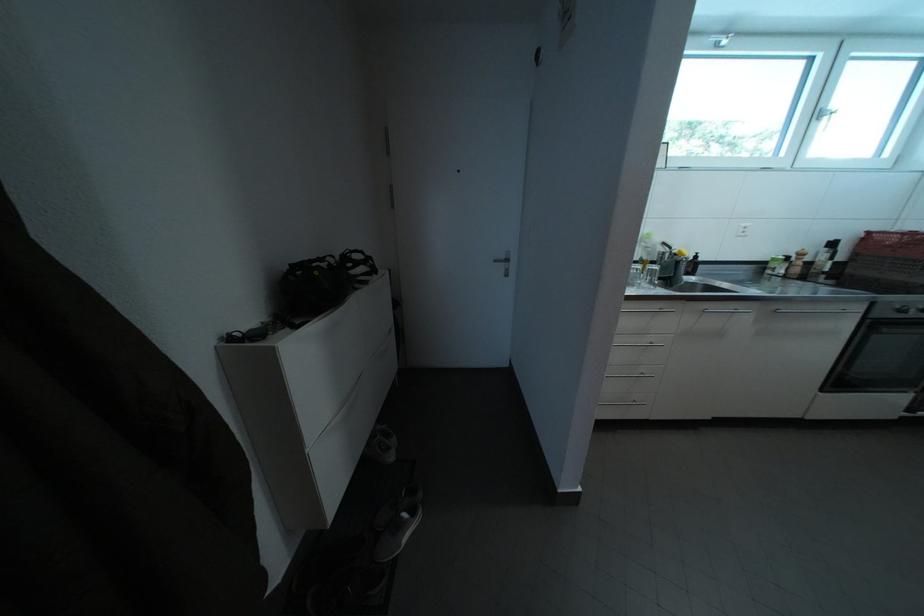
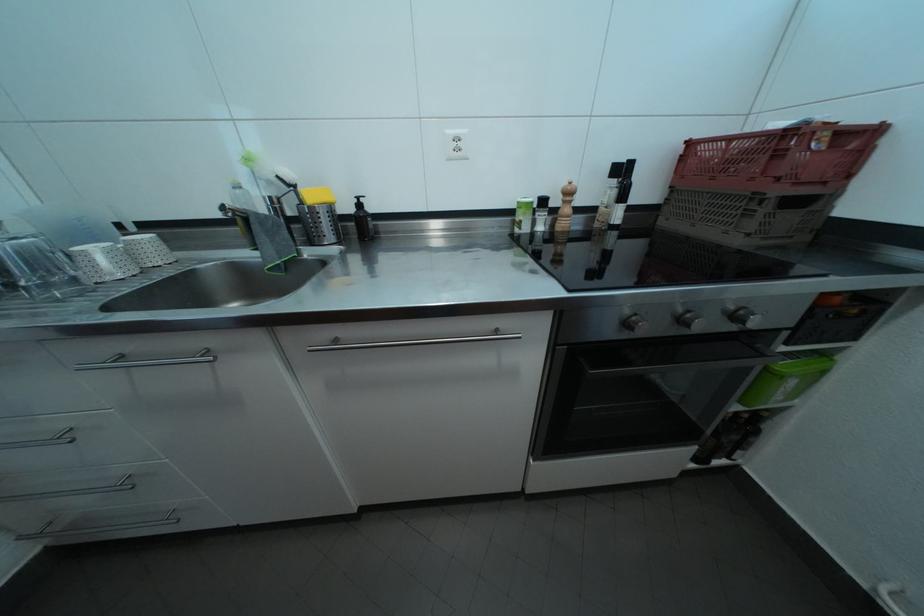
In the second image, find the point that corresponds to [842,251] in the first image.

(630, 176)